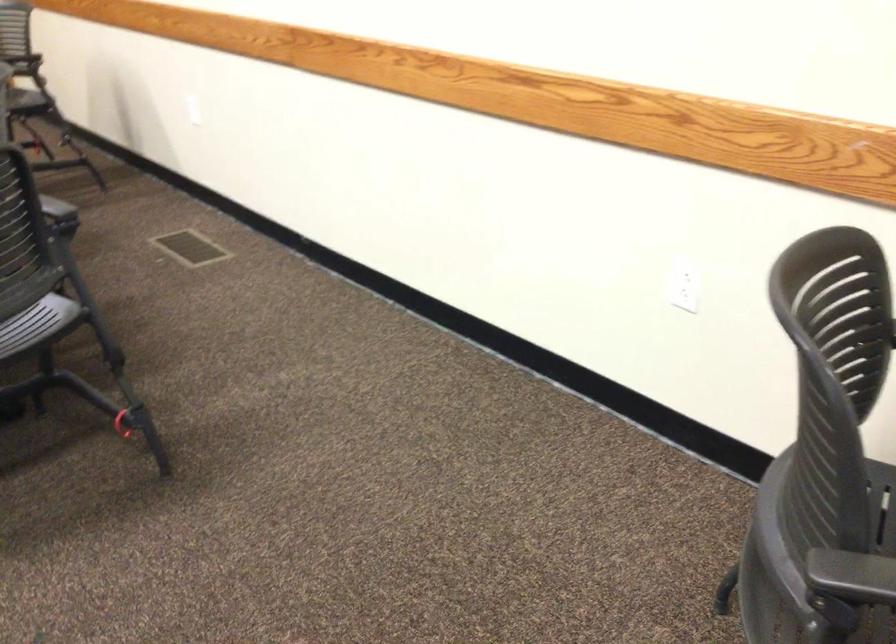
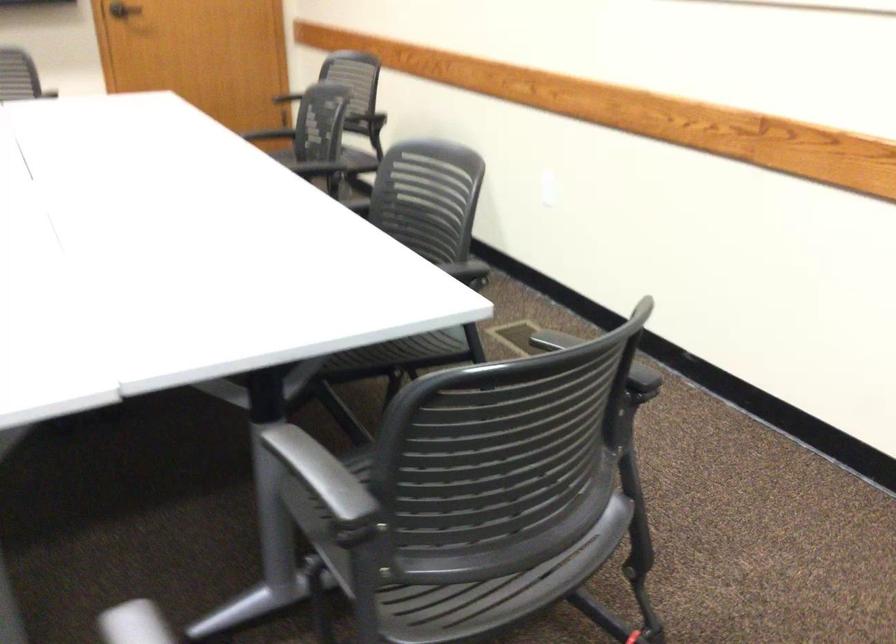
The point at (192, 114) is marked in the first image. Where is the corresponding point in the second image?

(547, 196)